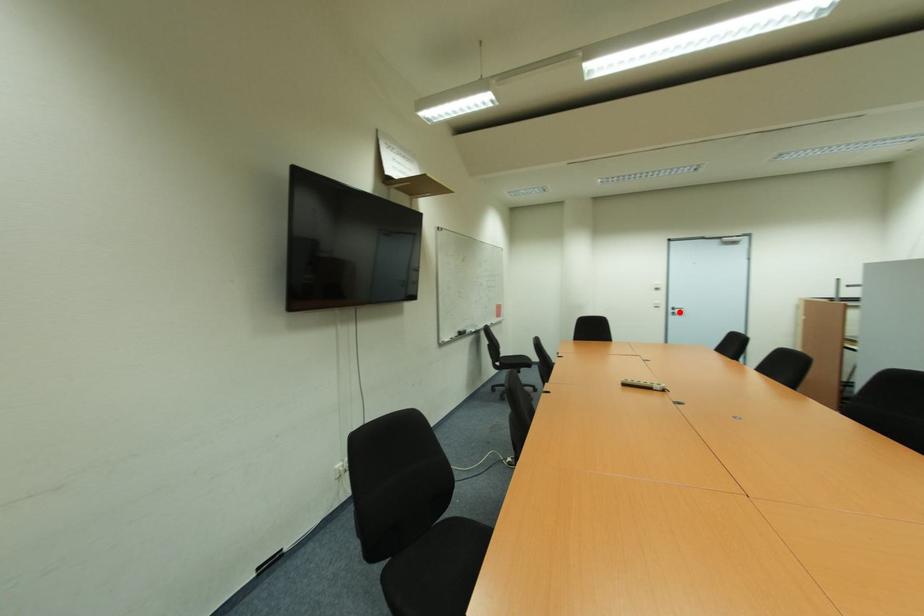
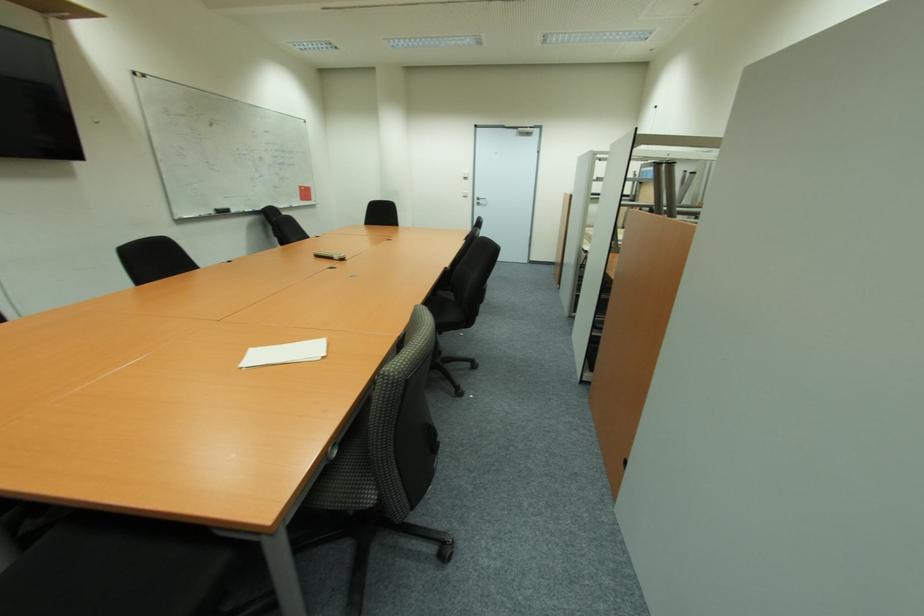
The point at the highlighted location is marked in the first image. Where is the corresponding point in the second image?

(483, 203)